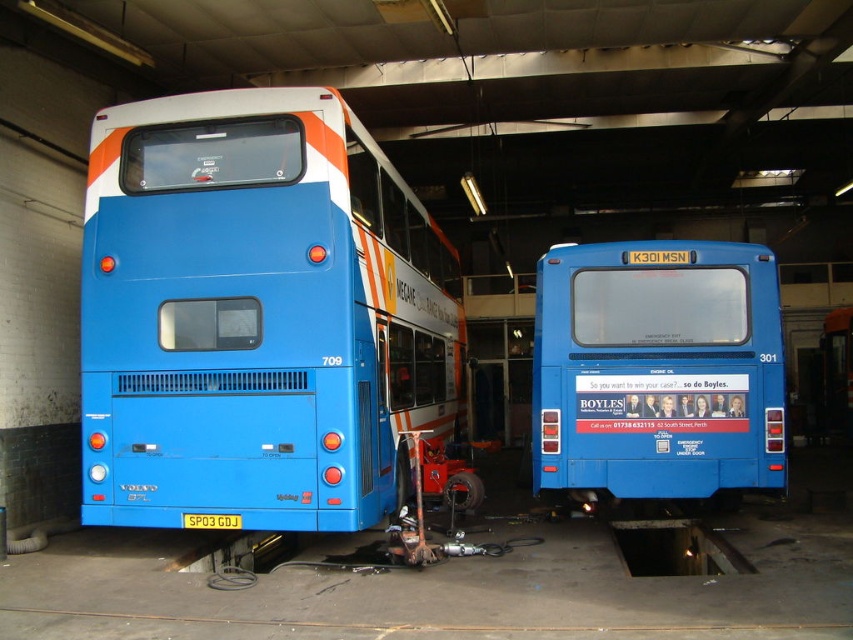
You are a technician in the bus maintenance facility. You need to access the blue matte bus at left for maintenance. The point marked at coordinates (257, 316) is where you should start your work. Is this point located on the blue matte bus at left?

The point at coordinates (257, 316) corresponds to the blue matte bus at left, so yes, the point is located on the blue matte bus at left.

You are a mechanic working in the bus maintenance facility. You need to determine which bus has a wider body to decide which one requires more space for repairs. Which bus between the blue matte bus at left and the blue matte bus at center has a wider body?

The blue matte bus at center has a wider body than the blue matte bus at left, so it requires more space for repairs.

You are a mechanic working in the bus maintenance facility. You need to determine which bus is taller between the blue matte bus at left and the blue matte bus at center. Which one is taller?

The blue matte bus at center is taller than the blue matte bus at left.